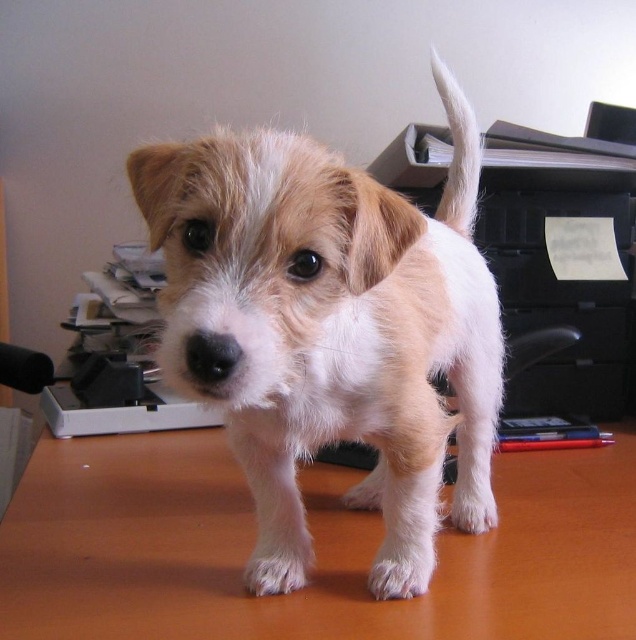
Between brown wooden desk at center and white fluffy tail at upper right, which one is positioned higher?

Positioned higher is white fluffy tail at upper right.

Does brown wooden desk at center have a greater width compared to white fluffy tail at upper right?

Correct, the width of brown wooden desk at center exceeds that of white fluffy tail at upper right.

Identify the location of brown wooden desk at center. This screenshot has width=636, height=640. (314, 547).

Between point (268, 150) and point (466, 193), which one is positioned behind?

The point (466, 193) is behind.

Identify the location of fuzzy white dog at center. This screenshot has height=640, width=636. (329, 330).

Can you confirm if fuzzy white dog at center is taller than brown wooden desk at center?

Indeed, fuzzy white dog at center has a greater height compared to brown wooden desk at center.

Is point (272, 262) positioned before point (114, 506)?

Yes, point (272, 262) is closer to viewer.

Is point (318, 156) positioned before point (450, 529)?

Yes, it is in front of point (450, 529).

The height and width of the screenshot is (640, 636). What are the coordinates of `fuzzy white dog at center` in the screenshot? It's located at point(329,330).